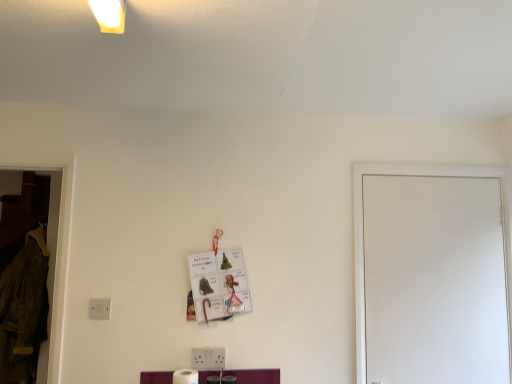
What is the approximate width of velvet brown coat at left?

velvet brown coat at left is 31.31 centimeters in width.

Find the location of a particular element. This screenshot has width=512, height=384. white matte door at right is located at coordinates (362, 229).

Where is `white plastic electric outlet at lower left`? white plastic electric outlet at lower left is located at coordinates (99, 309).

Who is shorter, white plastic electric outlet at lower left or white matte toilet paper at lower center?

With less height is white plastic electric outlet at lower left.

Which is more to the left, white plastic electric outlet at lower left or white matte toilet paper at lower center?

Positioned to the left is white plastic electric outlet at lower left.

At what (x,y) coordinates should I click in order to perform the action: click on toilet paper in front of the white plastic electric outlet at lower left. Please return your answer as a coordinate pair (x, y). Looking at the image, I should click on (185, 376).

Based on the photo, which of these two, white plastic electric outlet at lower left or white matte door at right, is bigger?

Bigger between the two is white matte door at right.

From a real-world perspective, who is located lower, white plastic electric outlet at lower left or white matte door at right?

white plastic electric outlet at lower left.

Considering the sizes of white plastic electric outlet at lower left and white matte door at right in the image, is white plastic electric outlet at lower left wider or thinner than white matte door at right?

Considering their sizes, white plastic electric outlet at lower left looks slimmer than white matte door at right.

Could you tell me if white plastic electric outlet at lower left is turned towards velvet brown coat at left?

No, white plastic electric outlet at lower left is not facing towards velvet brown coat at left.

Is white plastic electric outlet at lower left located outside velvet brown coat at left?

Yes, white plastic electric outlet at lower left is not within velvet brown coat at left.

Can you tell me how much white plastic electric outlet at lower left and velvet brown coat at left differ in facing direction?

The angle between the facing direction of white plastic electric outlet at lower left and the facing direction of velvet brown coat at left is 0.638 degrees.

Between white plastic electric outlet at lower left and velvet brown coat at left, which one has smaller width?

white plastic electric outlet at lower left.

Does white matte door at right touch white plastic electric outlet at lower left?

No.

Considering the relative sizes of white matte door at right and white plastic electric outlet at lower left in the image provided, is white matte door at right taller than white plastic electric outlet at lower left?

Indeed, white matte door at right has a greater height compared to white plastic electric outlet at lower left.

From the image's perspective, is white matte door at right above or below white plastic electric outlet at lower left?

Based on their image positions, white matte door at right is located above white plastic electric outlet at lower left.

In the image, there is a white plastic electric outlet at lower left. At what (x,y) coordinates should I click in order to perform the action: click on glass door above it (from the image's perspective). Please return your answer as a coordinate pair (x, y). Image resolution: width=512 pixels, height=384 pixels. Looking at the image, I should click on (x=362, y=229).

Does white matte toilet paper at lower center appear on the right side of white matte door at right?

In fact, white matte toilet paper at lower center is to the left of white matte door at right.

Is white matte toilet paper at lower center situated inside white matte door at right or outside?

white matte toilet paper at lower center exists outside the volume of white matte door at right.

From a real-world perspective, is white matte toilet paper at lower center on top of white matte door at right?

Incorrect, from a real-world perspective, white matte toilet paper at lower center is lower than white matte door at right.

From the image's perspective, is white matte toilet paper at lower center over white matte door at right?

No.

Is white matte door at right positioned beyond the bounds of white matte toilet paper at lower center?

Yes, white matte door at right is outside of white matte toilet paper at lower center.

Is white matte door at right aimed at white matte toilet paper at lower center?

No, white matte door at right is not facing towards white matte toilet paper at lower center.

From the image's perspective, would you say white matte door at right is shown under white matte toilet paper at lower center?

No, from the image's perspective, white matte door at right is not below white matte toilet paper at lower center.

Is white matte door at right closer to camera compared to white matte toilet paper at lower center?

That is False.

Is velvet brown coat at left looking in the opposite direction of white matte toilet paper at lower center?

velvet brown coat at left is not turned away from white matte toilet paper at lower center.

The width and height of the screenshot is (512, 384). I want to click on window that appears above the white matte toilet paper at lower center (from the image's perspective), so click(53, 248).

Is velvet brown coat at left positioned before white matte toilet paper at lower center?

No, it is behind white matte toilet paper at lower center.

Where is `electric outlet above the white matte toilet paper at lower center (from a real-world perspective)`? This screenshot has width=512, height=384. electric outlet above the white matte toilet paper at lower center (from a real-world perspective) is located at coordinates (99, 309).

Identify the location of electric outlet below the white matte door at right (from the image's perspective). (99, 309).

Which object lies further to the anchor point white plastic electric outlet at lower left, white matte door at right or white matte toilet paper at lower center?

Based on the image, white matte door at right appears to be further to white plastic electric outlet at lower left.

Estimate the real-world distances between objects in this image. Which object is further from white matte door at right, velvet brown coat at left or white matte toilet paper at lower center?

velvet brown coat at left.

Looking at the image, which one is located further to velvet brown coat at left, white plastic electric outlet at lower left or white matte toilet paper at lower center?

white matte toilet paper at lower center is positioned further to the anchor velvet brown coat at left.

Based on their spatial positions, is white matte toilet paper at lower center or velvet brown coat at left closer to white matte door at right?

The object closer to white matte door at right is white matte toilet paper at lower center.

Based on their spatial positions, is white matte toilet paper at lower center or white plastic electric outlet at lower left closer to velvet brown coat at left?

white plastic electric outlet at lower left is closer to velvet brown coat at left.

Considering their positions, is white plastic electric outlet at lower left positioned closer to white matte toilet paper at lower center than white matte door at right?

Based on the image, white plastic electric outlet at lower left appears to be nearer to white matte toilet paper at lower center.

From the picture: From the image, which object appears to be nearer to white matte door at right, white plastic electric outlet at lower left or white matte toilet paper at lower center?

white matte toilet paper at lower center is positioned closer to the anchor white matte door at right.

Estimate the real-world distances between objects in this image. Which object is closer to white matte door at right, white plastic electric outlet at lower left or velvet brown coat at left?

white plastic electric outlet at lower left is positioned closer to the anchor white matte door at right.

Locate an element on the screen. The image size is (512, 384). electric outlet located between velvet brown coat at left and white matte toilet paper at lower center in the left-right direction is located at coordinates (99, 309).

Where is `electric outlet between velvet brown coat at left and white matte door at right in the horizontal direction`? electric outlet between velvet brown coat at left and white matte door at right in the horizontal direction is located at coordinates (99, 309).

Where is `toilet paper situated between velvet brown coat at left and white matte door at right from left to right`? Image resolution: width=512 pixels, height=384 pixels. toilet paper situated between velvet brown coat at left and white matte door at right from left to right is located at coordinates (185, 376).

The height and width of the screenshot is (384, 512). I want to click on toilet paper between white plastic electric outlet at lower left and white matte door at right, so click(185, 376).